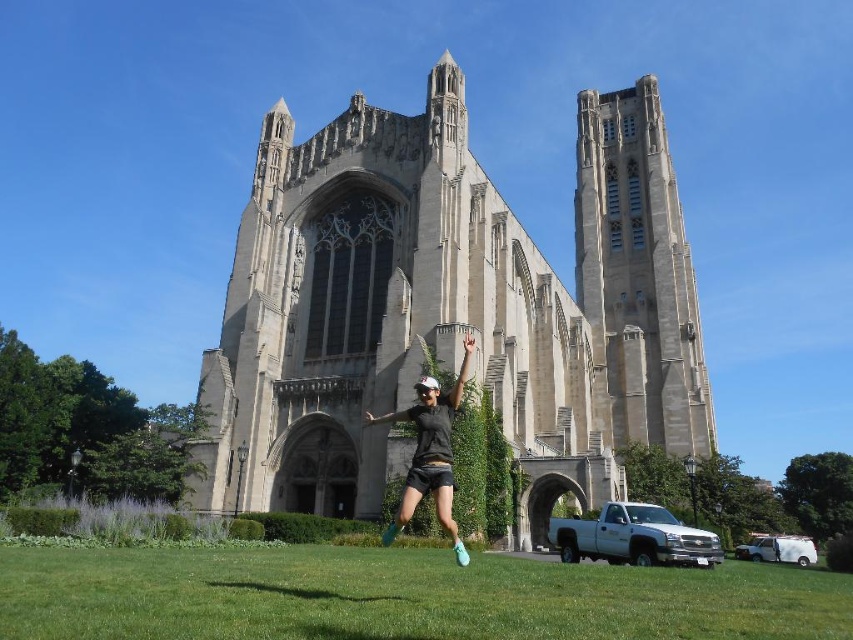
Question: Does stone church at center appear under black matte shorts at center?

Choices:
 (A) yes
 (B) no

Answer: (B)

Question: Which point is closer to the camera?

Choices:
 (A) stone church at center
 (B) black matte shorts at center

Answer: (B)

Question: Is stone church at center further to camera compared to black matte shorts at center?

Choices:
 (A) yes
 (B) no

Answer: (A)

Question: Is the position of stone church at center more distant than that of black matte shorts at center?

Choices:
 (A) no
 (B) yes

Answer: (B)

Question: Among these points, which one is nearest to the camera?

Choices:
 (A) (437, 112)
 (B) (412, 486)

Answer: (B)

Question: Among these objects, which one is nearest to the camera?

Choices:
 (A) stone church at center
 (B) black matte shorts at center

Answer: (B)